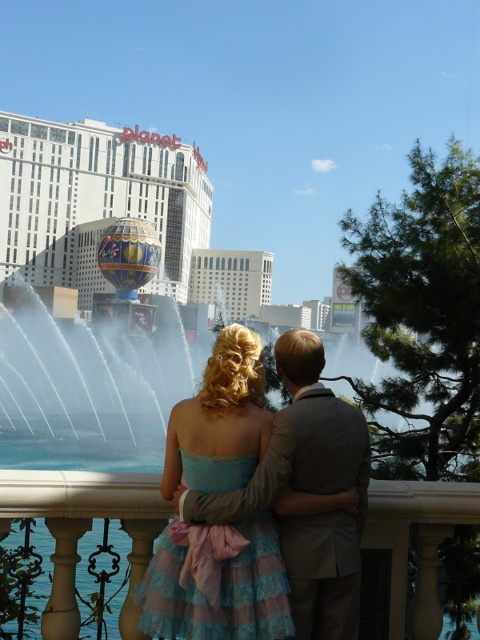
You are standing on the balcony and want to place a small potted plant on the white marble balustrade at lower center. The coordinates of the balustrade are given as point (83, 524). Can you confirm if this point is suitable for placing the plant?

Yes, the point (83, 524) is on the white marble balustrade at lower center, so it is suitable for placing the plant there.

You are a photographer planning to capture a photo of the scene. The teal satin dress at center and the white marble balustrade at lower center are part of the composition. Given that the minimum focus distance of your camera is 2.5 meters, will you be able to focus on both objects simultaneously?

The teal satin dress at center and the white marble balustrade at lower center are 2.68 meters apart from each other. Since the distance between them is greater than the camera minimum focus distance of 2.5 meters, the camera can focus on both objects simultaneously.